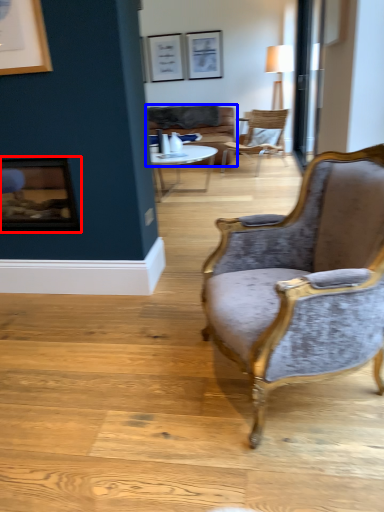
Question: Which object appears closest to the camera in this image, fireplace (highlighted by a red box) or studio couch (highlighted by a blue box)?

Choices:
 (A) fireplace
 (B) studio couch

Answer: (A)